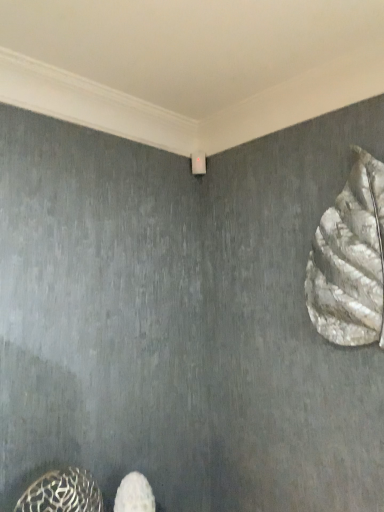
Question: From the image's perspective, relative to metallic patterned shoe at lower left, the 2th animal from the right, is white textured sculpture at right, which is the second animal in bottom-to-top order, above or below?

Choices:
 (A) below
 (B) above

Answer: (B)

Question: From a real-world perspective, is white textured sculpture at right, which ranks as the 1th animal in top-to-bottom order, positioned above or below metallic patterned shoe at lower left, which is counted as the second animal, starting from the top?

Choices:
 (A) below
 (B) above

Answer: (B)

Question: Which object is positioned closest to the metallic patterned shoe at lower left, which is counted as the second animal, starting from the top?

Choices:
 (A) white fabric shoe at lower center
 (B) white textured sculpture at right, which ranks as the 1th animal in top-to-bottom order

Answer: (A)

Question: Which is nearer to the white fabric shoe at lower center?

Choices:
 (A) white textured sculpture at right, which ranks as the 1th animal in top-to-bottom order
 (B) metallic patterned shoe at lower left, which is counted as the second animal, starting from the top

Answer: (B)